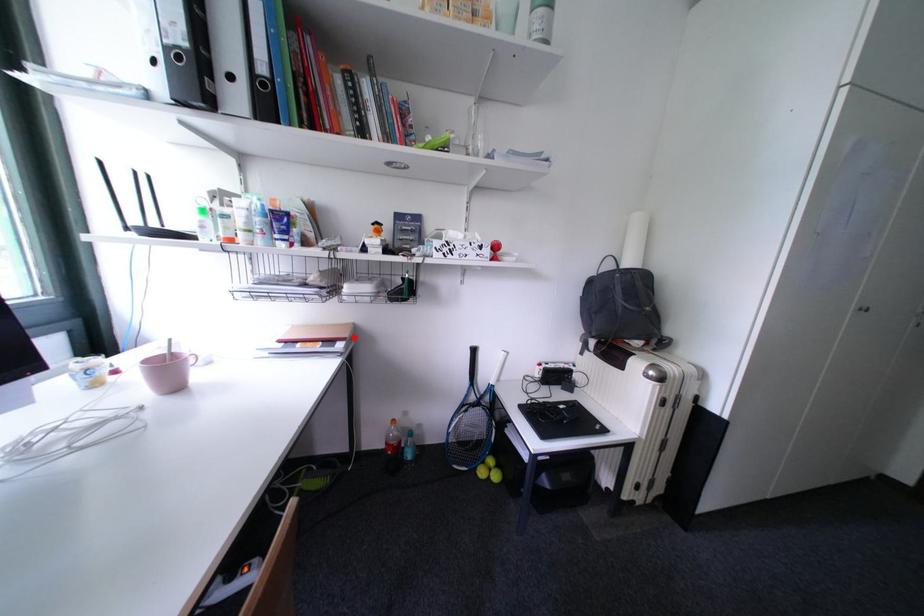
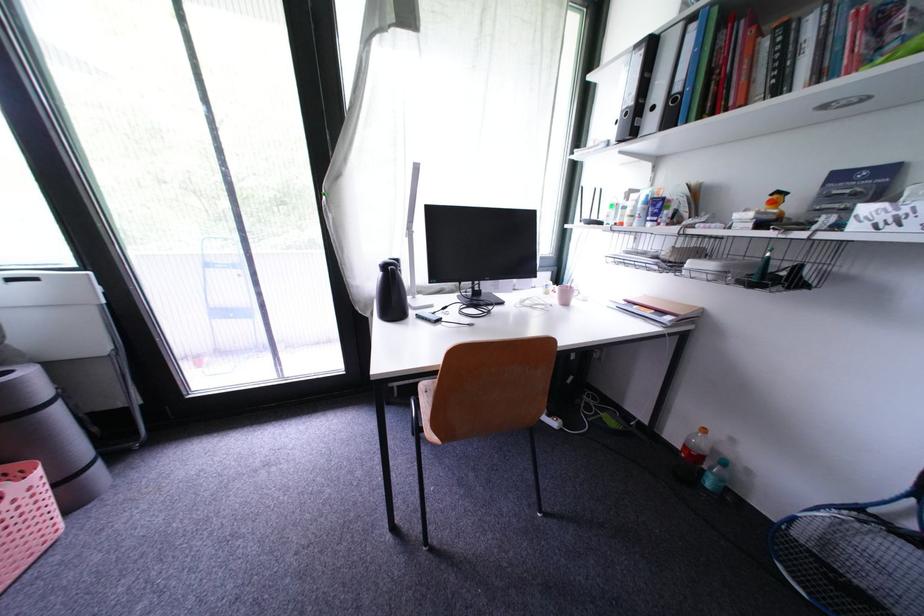
Locate, in the second image, the point that corresponds to the highlighted location in the first image.

(689, 315)